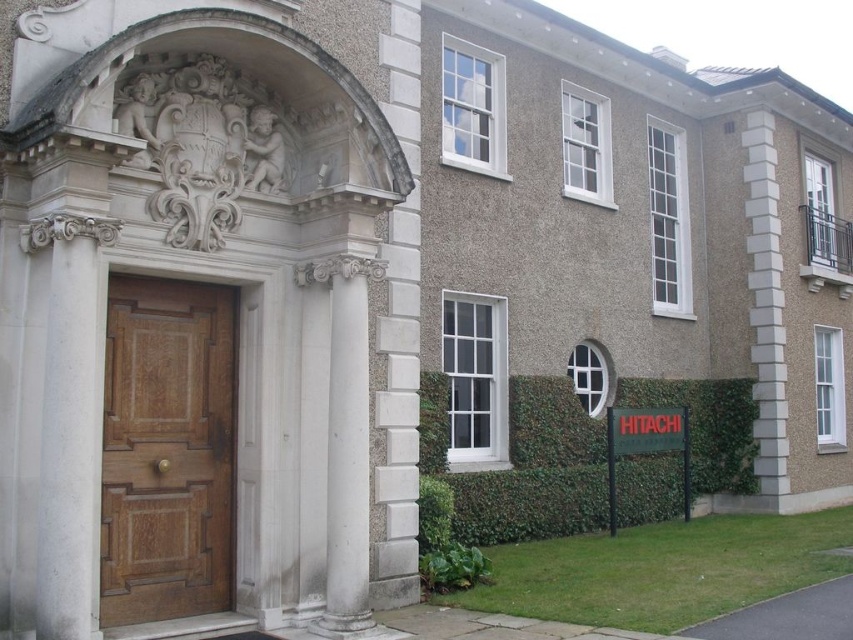
Question: Does wooden panelled door at center come behind green ivy hedge at lower right?

Choices:
 (A) yes
 (B) no

Answer: (B)

Question: Is wooden panelled door at center above green ivy hedge at lower right?

Choices:
 (A) yes
 (B) no

Answer: (A)

Question: Where is wooden panelled door at center located in relation to green ivy hedge at lower right in the image?

Choices:
 (A) left
 (B) right

Answer: (A)

Question: Which of the following is the closest to the observer?

Choices:
 (A) green ivy hedge at lower right
 (B) wooden panelled door at center

Answer: (B)